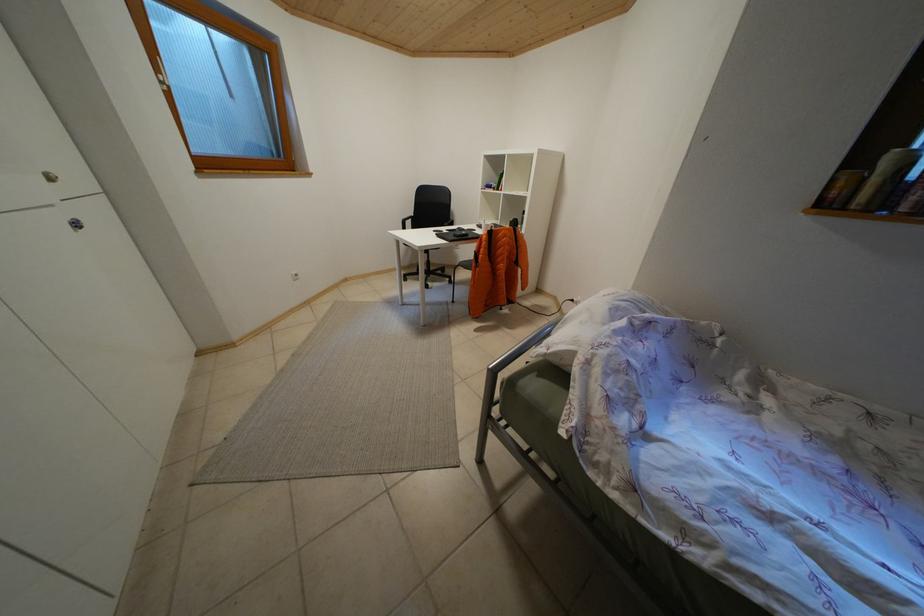
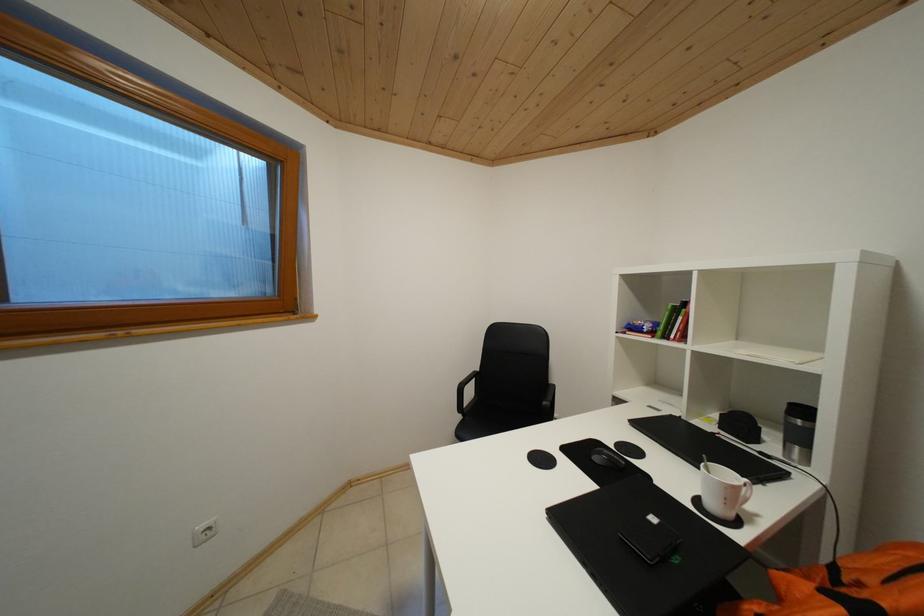
Question: What movement of the cameraman would produce the second image?

Choices:
 (A) Left
 (B) Right
 (C) Forward
 (D) Backward

Answer: (C)